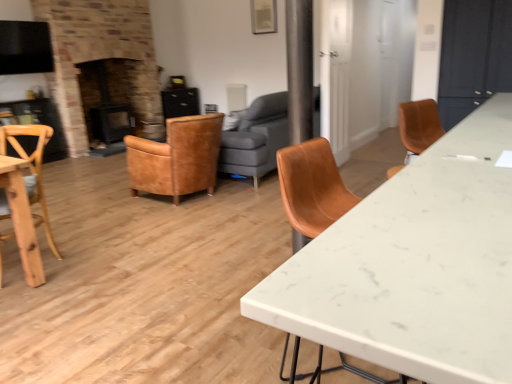
Where is `free location in front of leather armchair at center, the 2th chair in the left-to-right sequence`? This screenshot has height=384, width=512. free location in front of leather armchair at center, the 2th chair in the left-to-right sequence is located at coordinates (162, 222).